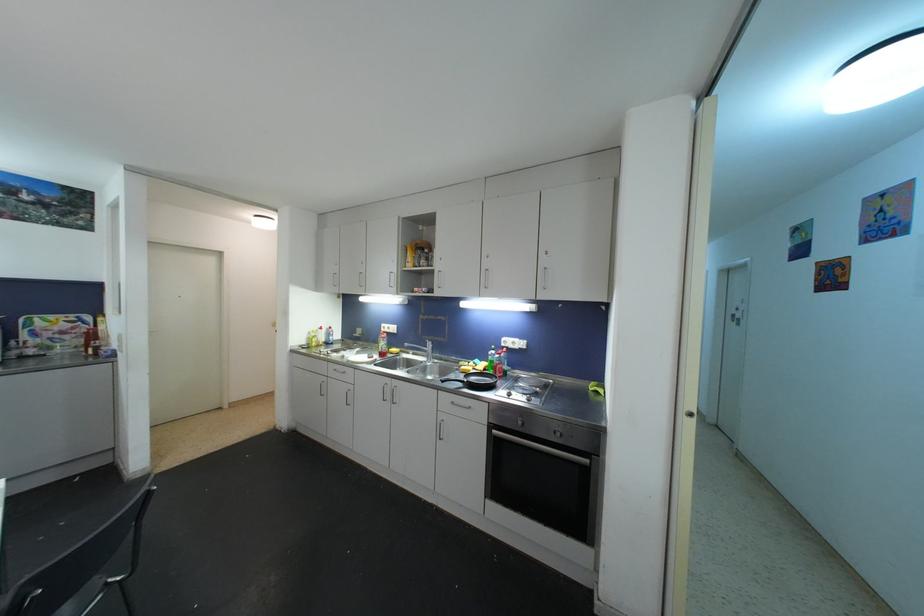
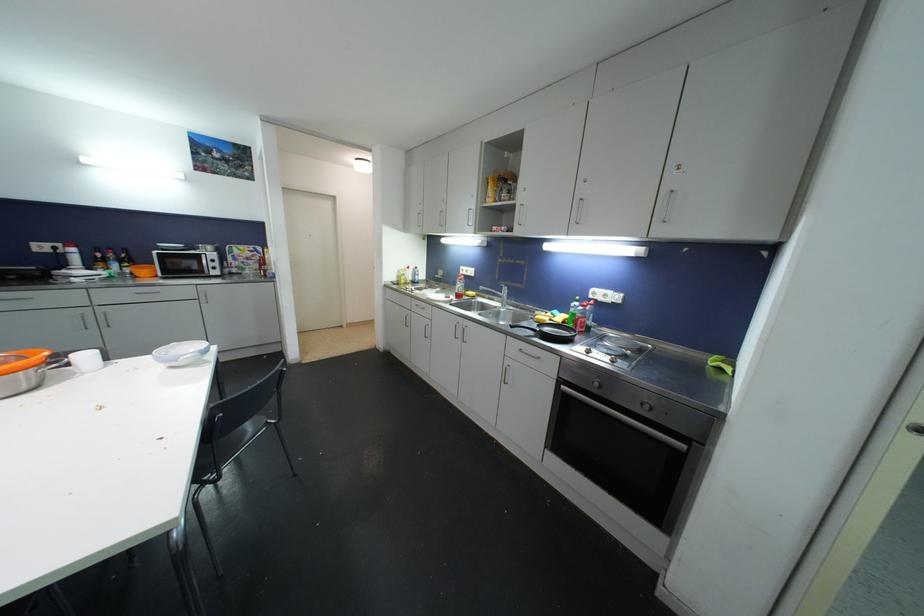
Where in the second image is the point corresponding to (385,347) from the first image?

(463, 288)